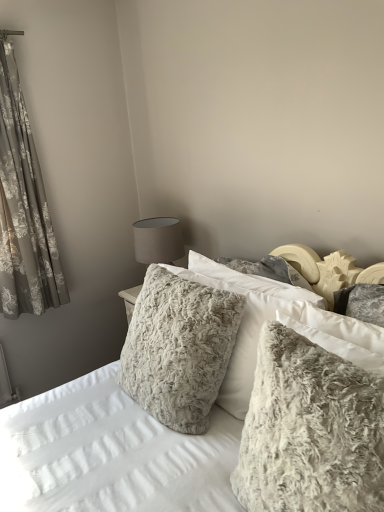
Question: Is floral-patterned fabric at left to the left or to the right of fuzzy white pillow at center, the first pillow when ordered from back to front, in the image?

Choices:
 (A) right
 (B) left

Answer: (B)

Question: Considering the positions of floral-patterned fabric at left and fuzzy white pillow at center, the 2th pillow from the front, in the image, is floral-patterned fabric at left taller or shorter than fuzzy white pillow at center, the 2th pillow from the front,?

Choices:
 (A) short
 (B) tall

Answer: (B)

Question: Considering the real-world distances, which object is closest to the floral-patterned fabric at left?

Choices:
 (A) fuzzy gray pillow at center, positioned as the 1th pillow in front-to-back order
 (B) fuzzy gray pillow at center
 (C) fuzzy white pillow at center, the first pillow when ordered from back to front

Answer: (C)

Question: Which of these objects is positioned farthest from the fuzzy gray pillow at center, the 2th pillow viewed from the back?

Choices:
 (A) fuzzy gray pillow at center
 (B) fuzzy white pillow at center, the first pillow when ordered from back to front
 (C) floral-patterned fabric at left

Answer: (C)